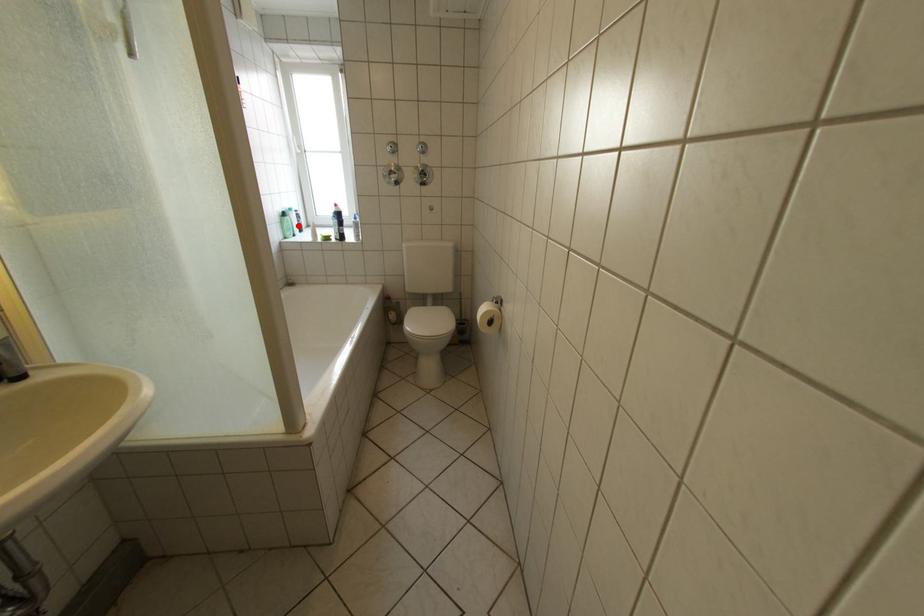
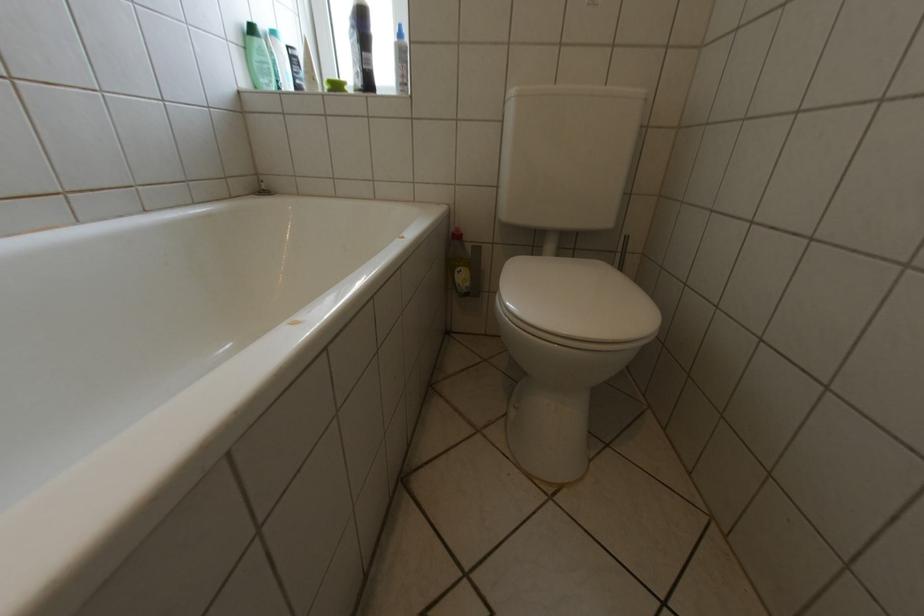
Question: I am providing you with two images of the same scene from different viewpoints. Image1 has a red point marked. In image2, the corresponding 3D location appears at what relative position? Reply with the corresponding letter.

Choices:
 (A) Closer
 (B) Farther

Answer: (B)